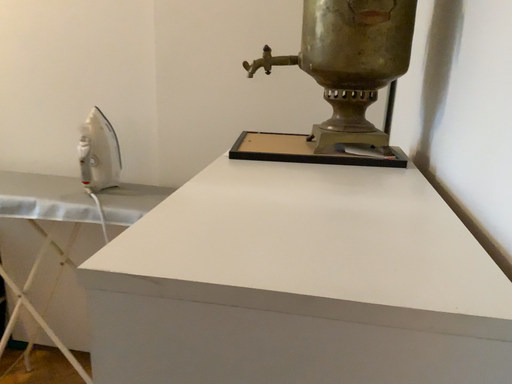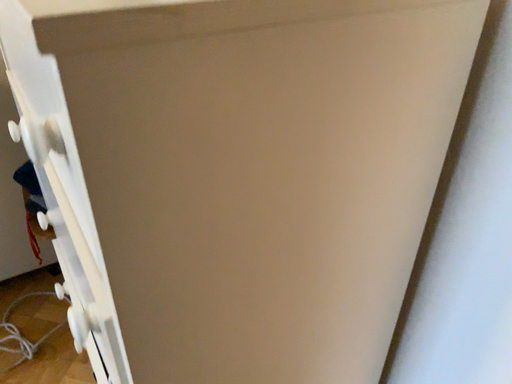
Question: How did the camera likely rotate when shooting the video?

Choices:
 (A) rotated upward
 (B) rotated downward

Answer: (B)